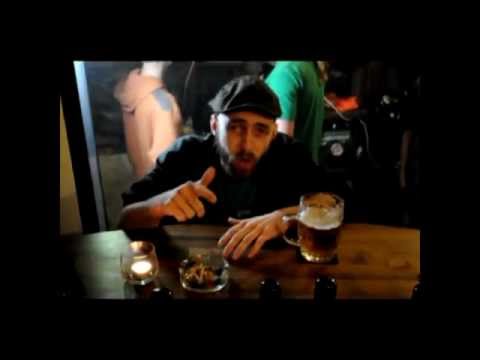
The height and width of the screenshot is (360, 480). Find the location of `handle`. handle is located at coordinates (290, 217).